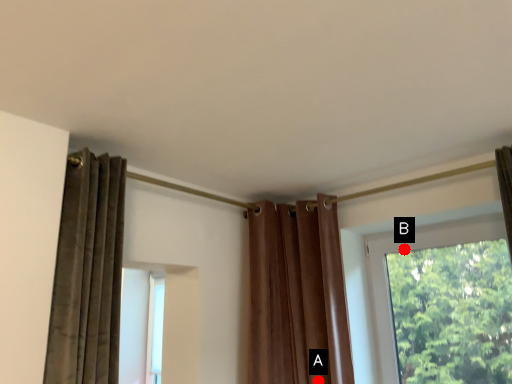
Question: Two points are circled on the image, labeled by A and B beside each circle. Which of the following is the closest to the observer?

Choices:
 (A) A is closer
 (B) B is closer

Answer: (A)